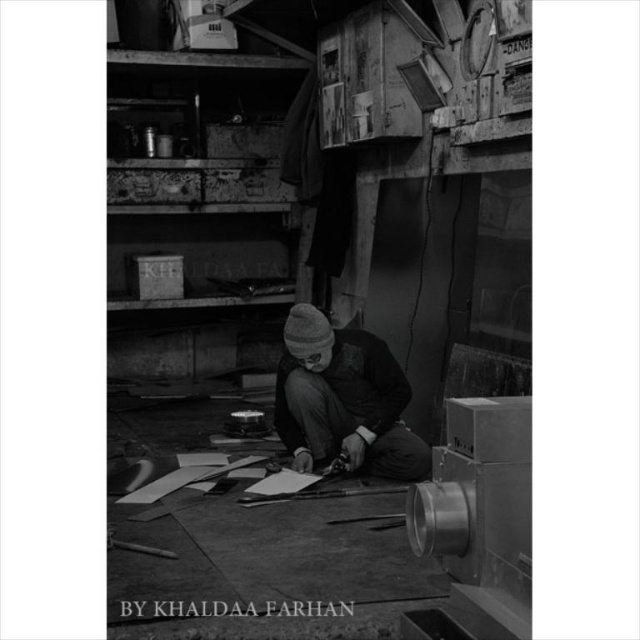
Question: Is metallic sheen scissors at center above dark gray knit hat at center?

Choices:
 (A) yes
 (B) no

Answer: (A)

Question: Which of the following is the closest to the observer?

Choices:
 (A) dark gray knit hat at center
 (B) metallic sheen scissors at center

Answer: (B)

Question: Which point is closer to the camera?

Choices:
 (A) (403, 474)
 (B) (269, 420)

Answer: (A)

Question: Where is metallic sheen scissors at center located in relation to dark gray knit hat at center in the image?

Choices:
 (A) below
 (B) above

Answer: (B)

Question: Where is metallic sheen scissors at center located in relation to dark gray knit hat at center in the image?

Choices:
 (A) left
 (B) right

Answer: (A)